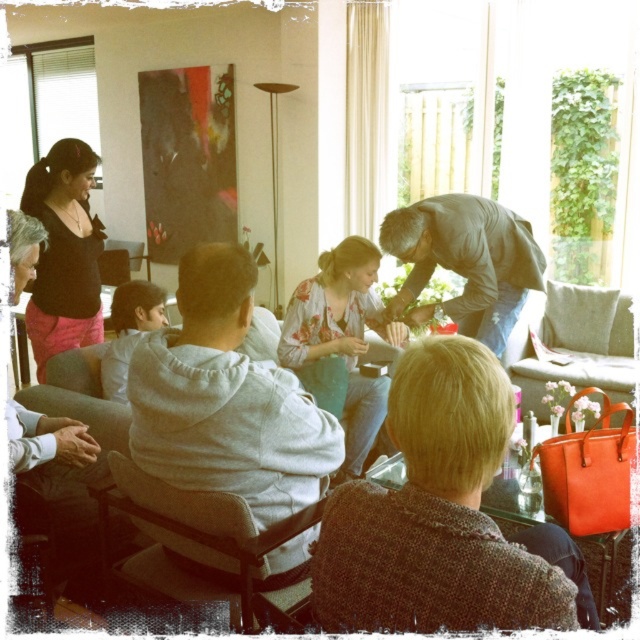
What is the color of the object located at the coordinates point (64,252)?

The object at point (64,252) is matte black.

You are a delivery person standing at the entrance of the living room. You need to place a package on the coffee table between the matte black top at upper left and the light gray fabric chair at lower left. Can you reach the coffee table from your current position without moving any furniture?

The distance between the matte black top at upper left and the light gray fabric chair at lower left is 5.00 feet. Since the coffee table is between them, you can likely reach it without moving any furniture as the space allows for access.